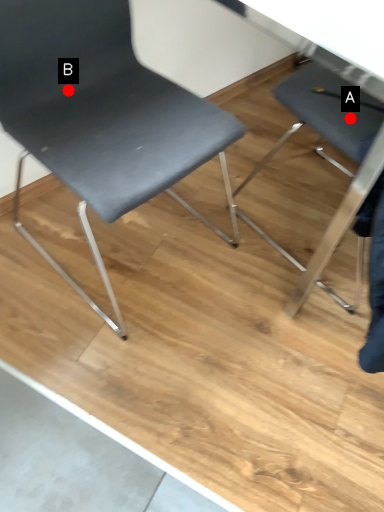
Question: Two points are circled on the image, labeled by A and B beside each circle. Which of the following is the closest to the observer?

Choices:
 (A) A is closer
 (B) B is closer

Answer: (B)